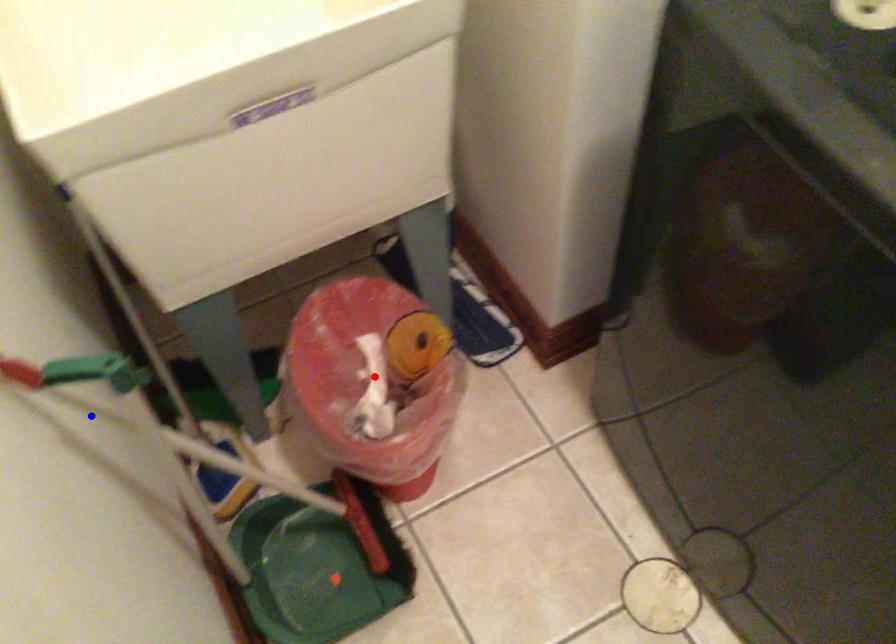
Question: Two points are marked on the image. Which point is closer to the camera?

Choices:
 (A) Blue point is closer.
 (B) Red point is closer.

Answer: (A)